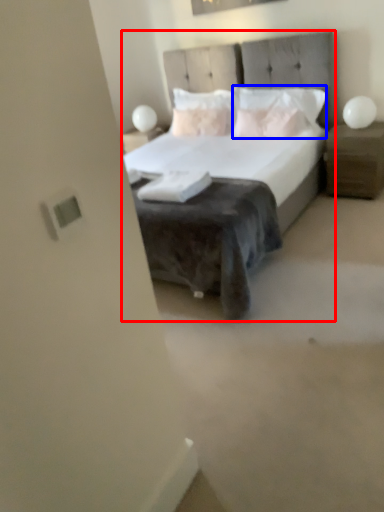
Question: Which object appears farthest to the camera in this image, bed (highlighted by a red box) or pillow (highlighted by a blue box)?

Choices:
 (A) bed
 (B) pillow

Answer: (B)